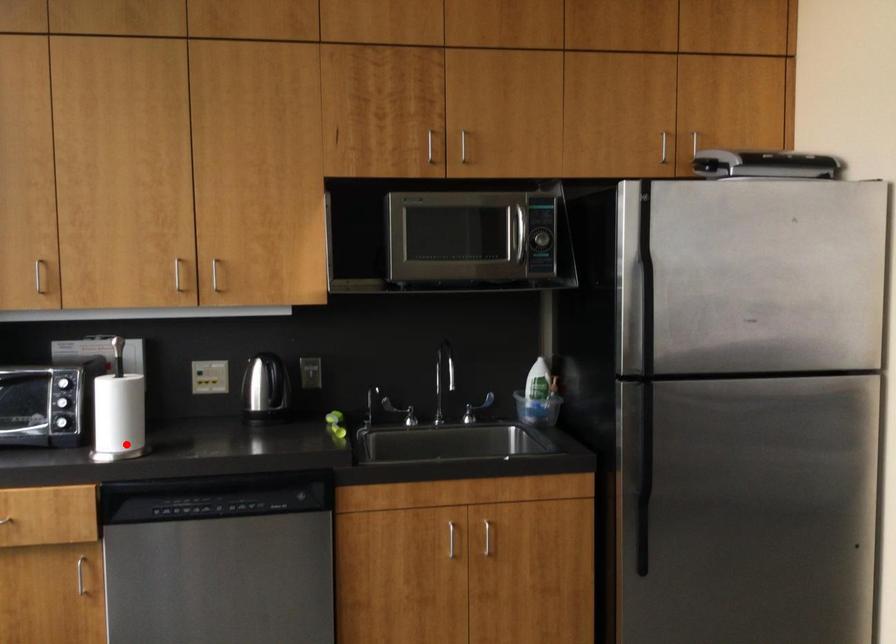
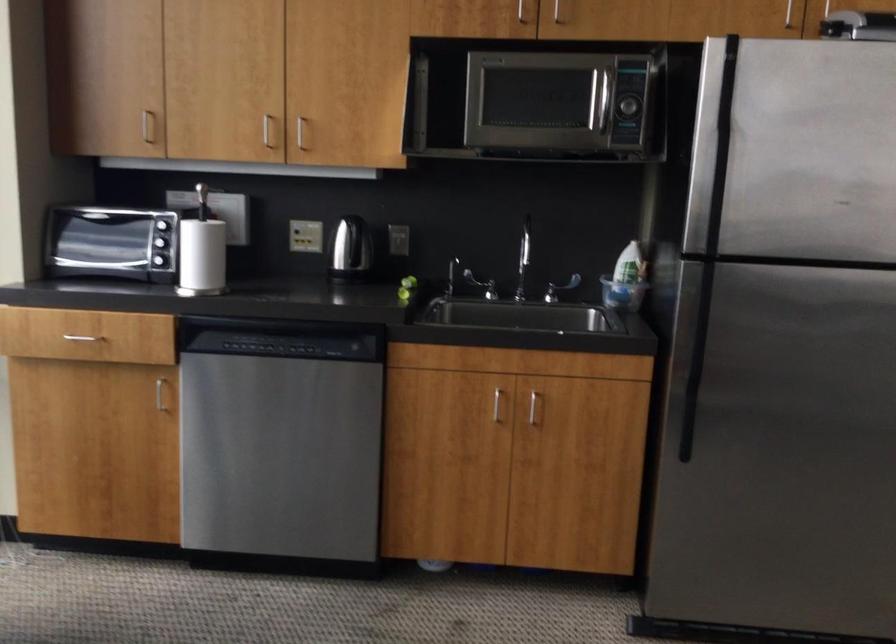
In the second image, find the point that corresponds to the highlighted location in the first image.

(202, 281)